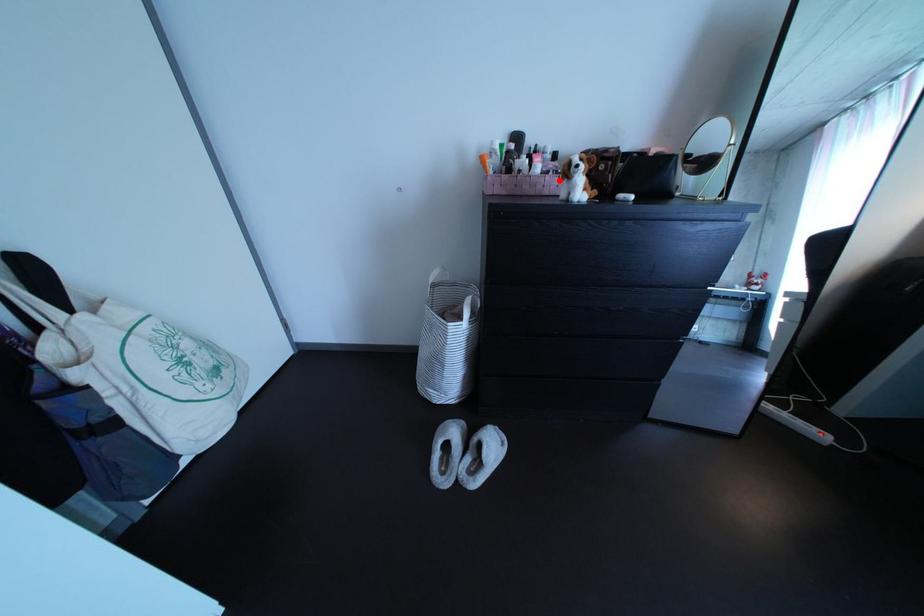
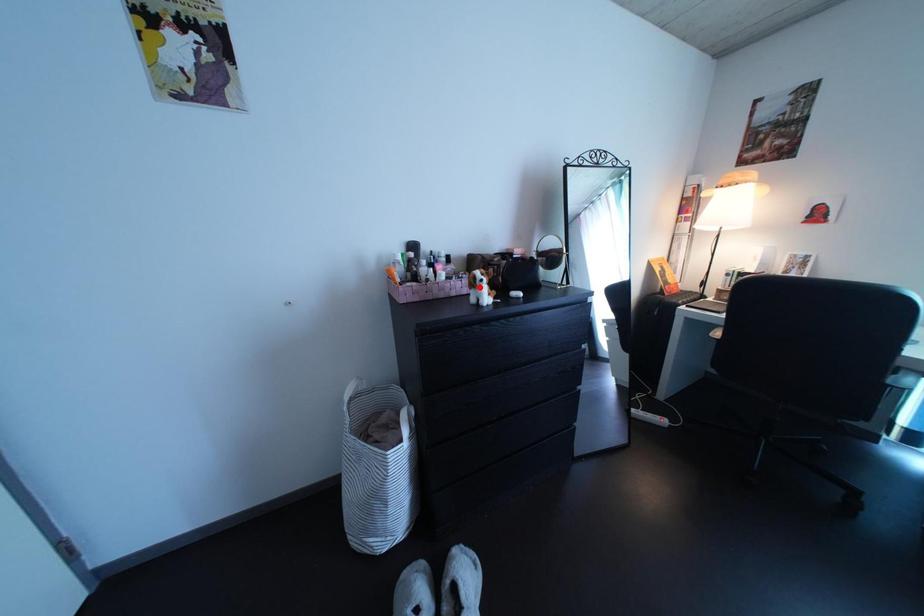
I am providing you with two images of the same scene from different viewpoints. A red point is marked on the first image and another point is marked on the second image. Are the points marked in image1 and image2 representing the same 3D position?

No